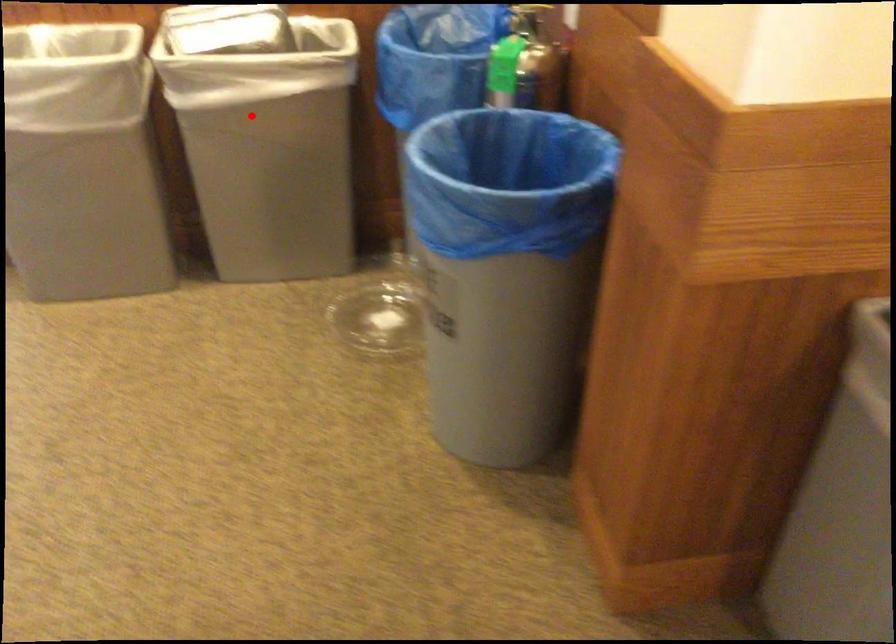
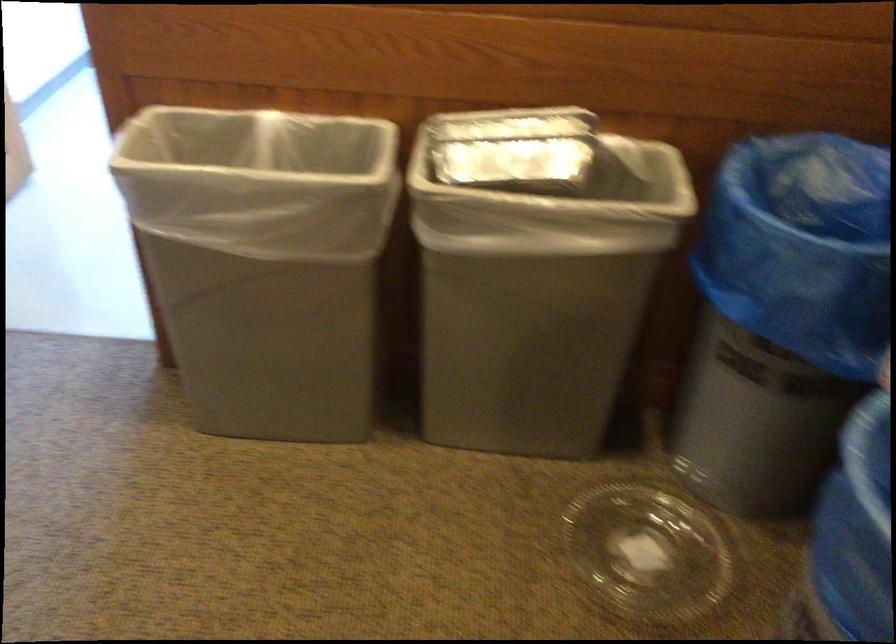
Find the pixel in the second image that matches the highlighted location in the first image.

(533, 272)